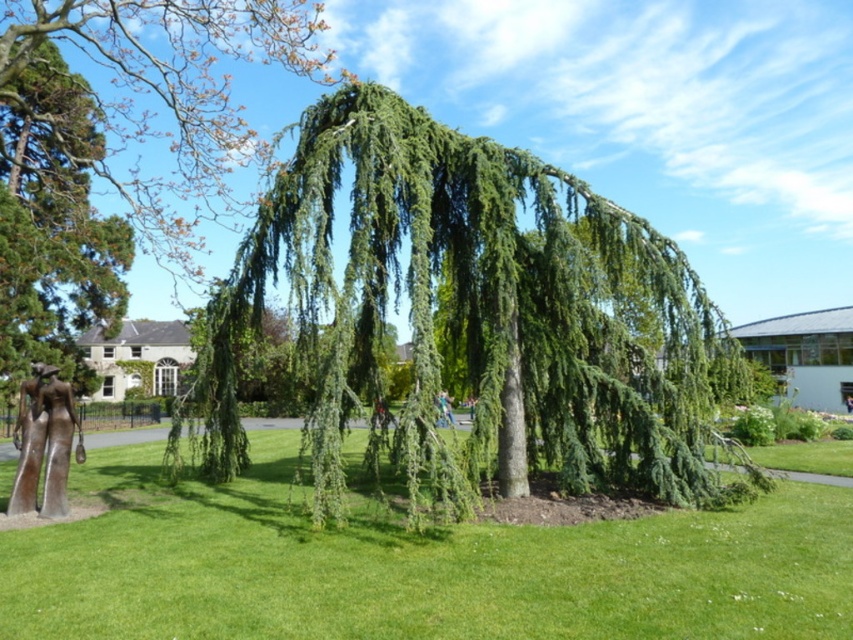
Question: Is green grass at lower left to the right of green needle-like foliage at center from the viewer's perspective?

Choices:
 (A) yes
 (B) no

Answer: (A)

Question: Which of the following is the farthest from the observer?

Choices:
 (A) (49, 452)
 (B) (560, 384)

Answer: (B)

Question: Is green grass at lower left above green needle-like foliage at center?

Choices:
 (A) yes
 (B) no

Answer: (B)

Question: Is green needle-like leaves at center further to the viewer compared to green needle-like foliage at center?

Choices:
 (A) no
 (B) yes

Answer: (A)

Question: Among these objects, which one is farthest from the camera?

Choices:
 (A) green needle-like leaves at center
 (B) green grass at lower left
 (C) bronze statue at lower left

Answer: (C)

Question: Which of these objects is positioned closest to the green needle-like leaves at center?

Choices:
 (A) bronze statue at lower left
 (B) green grass at lower left
 (C) green needle-like foliage at center

Answer: (B)